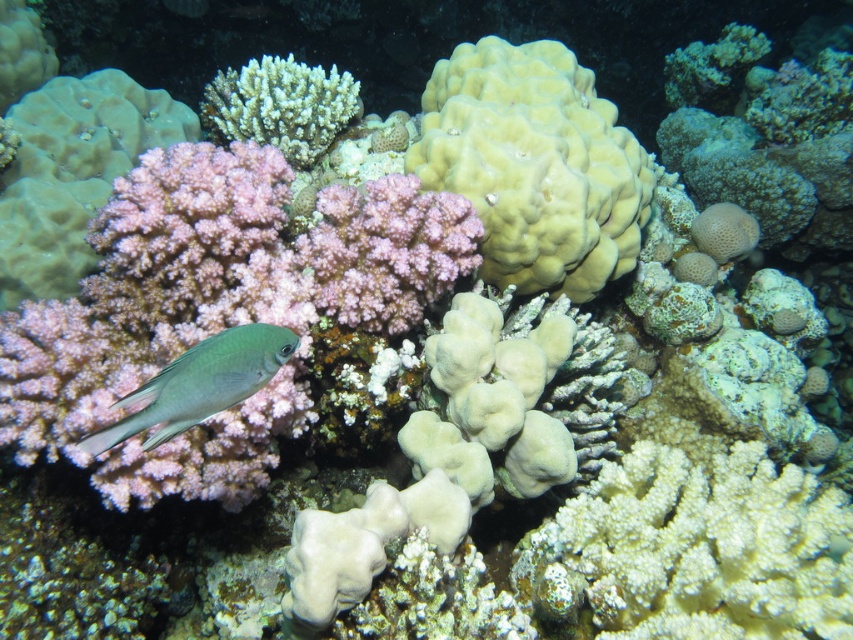
You are a scuba diver swimming in the underwater scene. You see the white coral at upper center and the green matte fish at lower left. Which object is positioned more to the left?

The white coral at upper center is positioned to the left of the green matte fish at lower left, so it is more to the left.

You are a marine biologist studying underwater formations. You observe the yellow matte coral at center in the image. What are the coordinates of its position in the scene?

The yellow matte coral at center is located at coordinates (535, 164).

You are a diver exploring the underwater scene. You see the yellow matte coral at center and the green matte fish at lower left. Which object is located higher in the water?

The yellow matte coral at center is positioned over the green matte fish at lower left, so it is higher in the water.